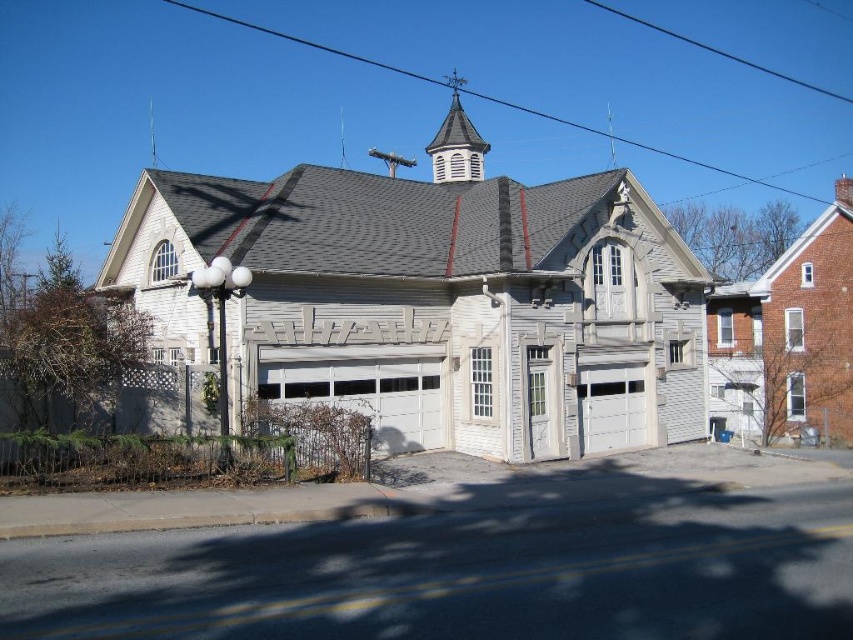
You are an architect designing a new building and want to incorporate elements from this scene. If you want to ensure the white wood church at center is visually balanced with the white wood shingles at upper center, what adjustment could you make based on their sizes?

The white wood church at center has a smaller size compared to the white wood shingles at upper center. To balance them, you could either increase the size of the white wood church at center or decrease the size of the white wood shingles at upper center.

You are a delivery person trying to unload a large delivery truck that is 3 meters wide. You see the white painted wood garage door at center and the white smooth garage door at center. Which garage door should you use to ensure your truck fits through?

The white painted wood garage door at center has a larger width than the white smooth garage door at center, so you should use the white painted wood garage door at center to ensure your truck fits through.